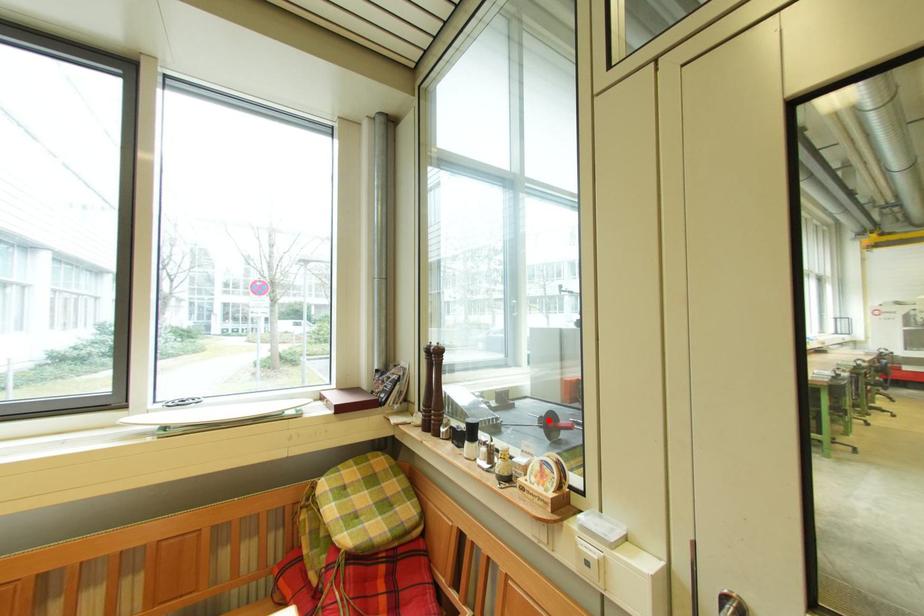
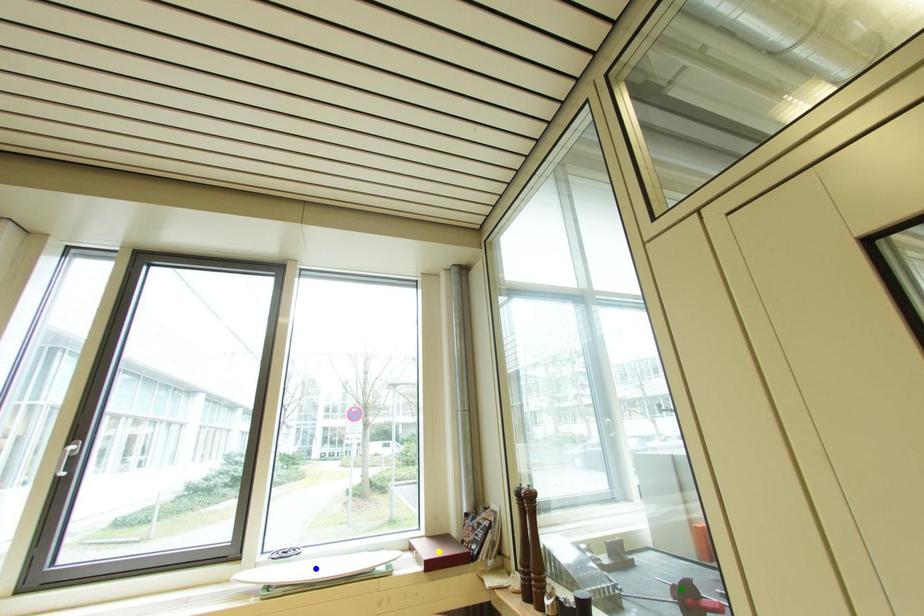
Question: I am providing you with two images of the same scene from different viewpoints. A red point is marked on the first image. You are given multiple points on the second image. Which point in image 2 is actually the same real-world point as the red point in image 1?

Choices:
 (A) green point
 (B) yellow point
 (C) blue point

Answer: (A)